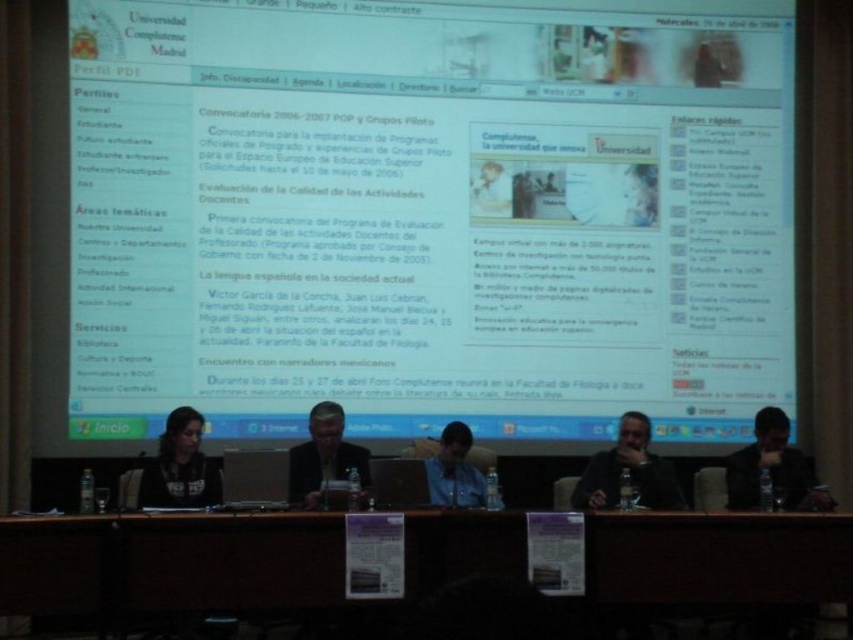
Is white glossy screen at upper center bigger than brown wood table at center?

Incorrect, white glossy screen at upper center is not larger than brown wood table at center.

Is point (695, 216) less distant than point (669, 573)?

No.

Does point (671, 346) lie in front of point (308, 545)?

No.

At what (x,y) coordinates should I click in order to perform the action: click on white glossy screen at upper center. Please return your answer as a coordinate pair (x, y). The height and width of the screenshot is (640, 853). Looking at the image, I should click on (421, 216).

Between dark hair at right and dark gray jacket at upper center, which one appears on the right side from the viewer's perspective?

From the viewer's perspective, dark gray jacket at upper center appears more on the right side.

Who is positioned more to the left, dark hair at right or dark gray jacket at upper center?

From the viewer's perspective, dark hair at right appears more on the left side.

Describe the element at coordinates (773, 468) in the screenshot. I see `dark hair at right` at that location.

What are the coordinates of `dark hair at right` in the screenshot? It's located at (773, 468).

Who is positioned more to the right, matte black shirt at lower left or blue shirt at center?

blue shirt at center is more to the right.

In the scene shown: Is matte black shirt at lower left positioned in front of blue shirt at center?

Yes, matte black shirt at lower left is in front of blue shirt at center.

Where is `matte black shirt at lower left`? The width and height of the screenshot is (853, 640). matte black shirt at lower left is located at coordinates (180, 467).

You are a GUI agent. You are given a task and a screenshot of the screen. Output one action in this format:
    pyautogui.click(x=<x>, y=<y>)
    Task: Click on the matte black shirt at lower left
    
    Given the screenshot: What is the action you would take?
    pyautogui.click(x=180, y=467)